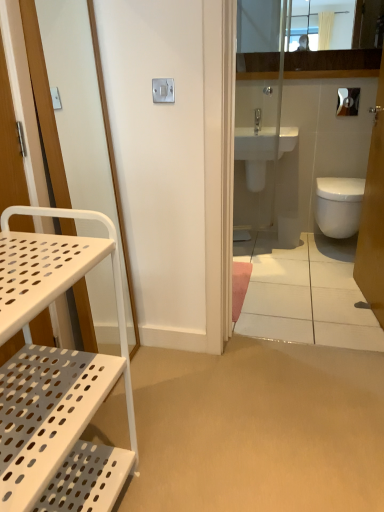
Identify the location of vacant space in white matte bidet at center, which appears as the second bidet when viewed from the right (from a real-world perspective). Image resolution: width=384 pixels, height=512 pixels. (257, 233).